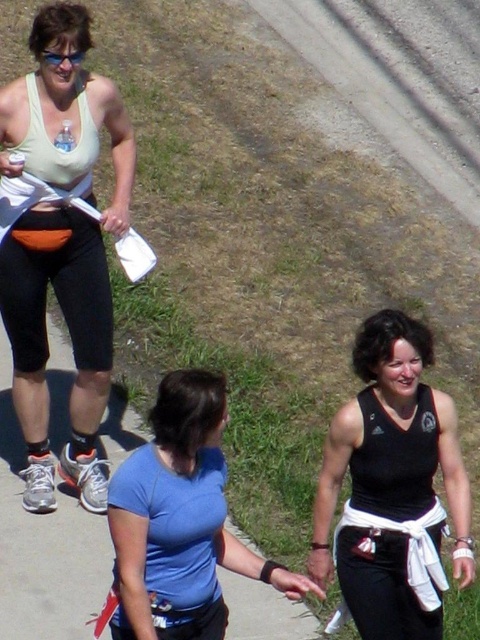
Describe the element at coordinates (393, 442) in the screenshot. I see `black matte tank top at lower right` at that location.

Does black matte tank top at lower right have a lesser height compared to clear plastic goggles at upper left?

No, black matte tank top at lower right is not shorter than clear plastic goggles at upper left.

Describe the element at coordinates (393, 442) in the screenshot. I see `black matte tank top at lower right` at that location.

Identify the location of black matte tank top at lower right. (393, 442).

Which is below, blue fabric shirt at center or clear plastic goggles at upper left?

blue fabric shirt at center

Which of these two, blue fabric shirt at center or clear plastic goggles at upper left, stands taller?

Standing taller between the two is blue fabric shirt at center.

Does point (299, 577) come farther from viewer compared to point (81, 58)?

No, (299, 577) is closer to viewer.

I want to click on blue fabric shirt at center, so click(x=180, y=520).

Does matte white tank top at upper left have a greater height compared to clear plastic goggles at upper left?

Yes, matte white tank top at upper left is taller than clear plastic goggles at upper left.

Which is below, matte white tank top at upper left or clear plastic goggles at upper left?

matte white tank top at upper left is below.

Find the location of `matte white tank top at upper left`. matte white tank top at upper left is located at coordinates (61, 250).

The height and width of the screenshot is (640, 480). I want to click on matte white tank top at upper left, so click(61, 250).